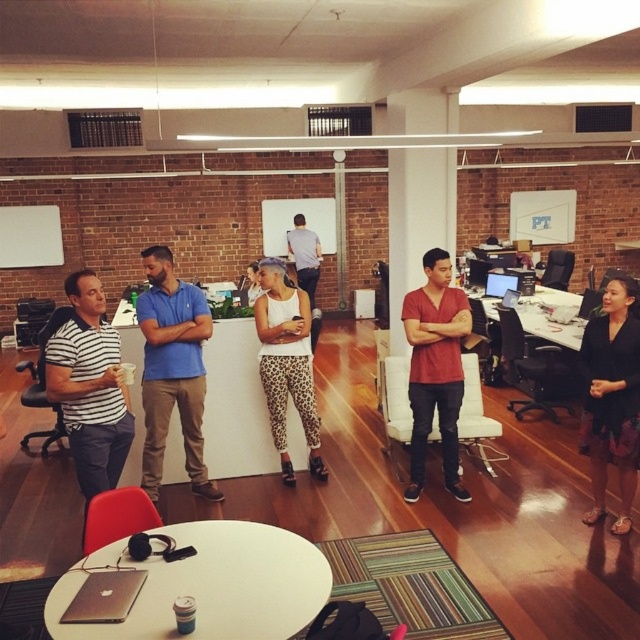
Question: Which point is farther from the camera taking this photo?

Choices:
 (A) (269, 432)
 (B) (628, 472)

Answer: (A)

Question: From the image, what is the correct spatial relationship of black fabric skirt at lower right in relation to leopard print pants at center?

Choices:
 (A) left
 (B) right

Answer: (B)

Question: Which of the following is the closest to the observer?

Choices:
 (A) (253, 305)
 (B) (605, 384)

Answer: (B)

Question: Which object appears farthest from the camera in this image?

Choices:
 (A) black fabric skirt at lower right
 (B) blue cotton polo shirt at center
 (C) striped cotton shirt at left
 (D) leopard print pants at center

Answer: (D)

Question: Can you confirm if matte red t-shirt at center is positioned to the right of glossy plastic monitor at center?

Choices:
 (A) no
 (B) yes

Answer: (A)

Question: Considering the relative positions of blue cotton polo shirt at center and leopard print pants at center in the image provided, where is blue cotton polo shirt at center located with respect to leopard print pants at center?

Choices:
 (A) below
 (B) above

Answer: (A)